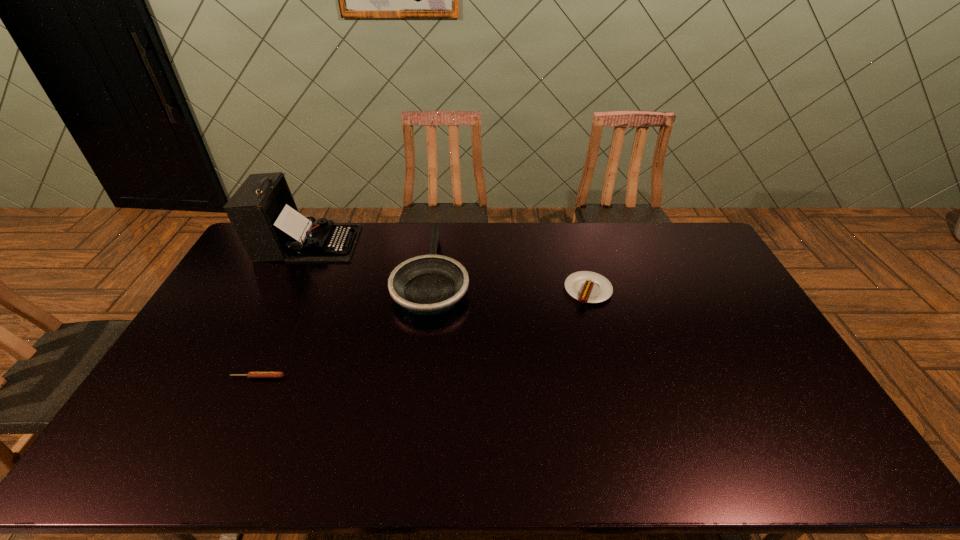
You are a GUI agent. You are given a task and a screenshot of the screen. Output one action in this format:
    pyautogui.click(x=<x>, y=<y>)
    Task: Click on the free space that is in between the taller sausage and the second tallest object
    This screenshot has width=960, height=540.
    Given the screenshot: What is the action you would take?
    pyautogui.click(x=511, y=282)

At what (x,y) coordinates should I click in order to perform the action: click on vacant area that lies between the second tallest object and the third tallest object. Please return your answer as a coordinate pair (x, y). Looking at the image, I should click on (511, 282).

Identify the location of unoccupied position between the typewriter and the shortest object. (282, 310).

Locate an element on the screen. This screenshot has height=540, width=960. free spot between the third shortest object and the third tallest object is located at coordinates (511, 282).

This screenshot has width=960, height=540. I want to click on vacant space in between the nearer sausage and the rightmost object, so click(x=423, y=334).

Locate an element on the screen. This screenshot has height=540, width=960. blank region between the frying pan and the shorter sausage is located at coordinates (345, 325).

Where is `the second closest object to the typewriter`? This screenshot has width=960, height=540. the second closest object to the typewriter is located at coordinates (251, 374).

Find the location of `object that stands as the third closest to the rightmost object`. object that stands as the third closest to the rightmost object is located at coordinates (251, 374).

You are a GUI agent. You are given a task and a screenshot of the screen. Output one action in this format:
    pyautogui.click(x=<x>, y=<y>)
    Task: Click on the vacant space that satisfies the following two spatial constraints: 1. on the handle side of the frying pan; 2. inside the open case of the typewriter
    Image resolution: width=960 pixels, height=540 pixels.
    Given the screenshot: What is the action you would take?
    pyautogui.click(x=436, y=244)

Locate an element on the screen. vacant space that satisfies the following two spatial constraints: 1. on the back side of the shortest object; 2. inside the open case of the tallest object is located at coordinates (319, 244).